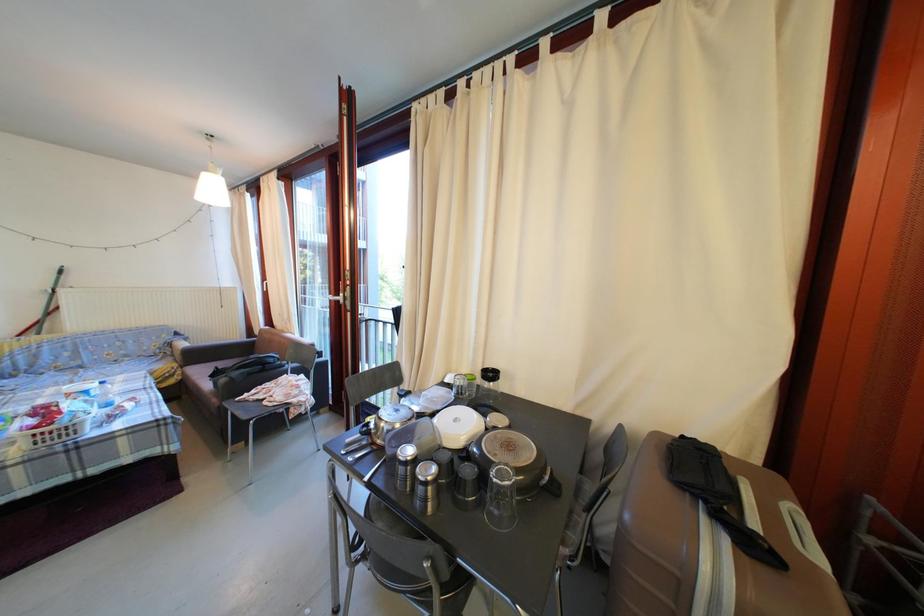
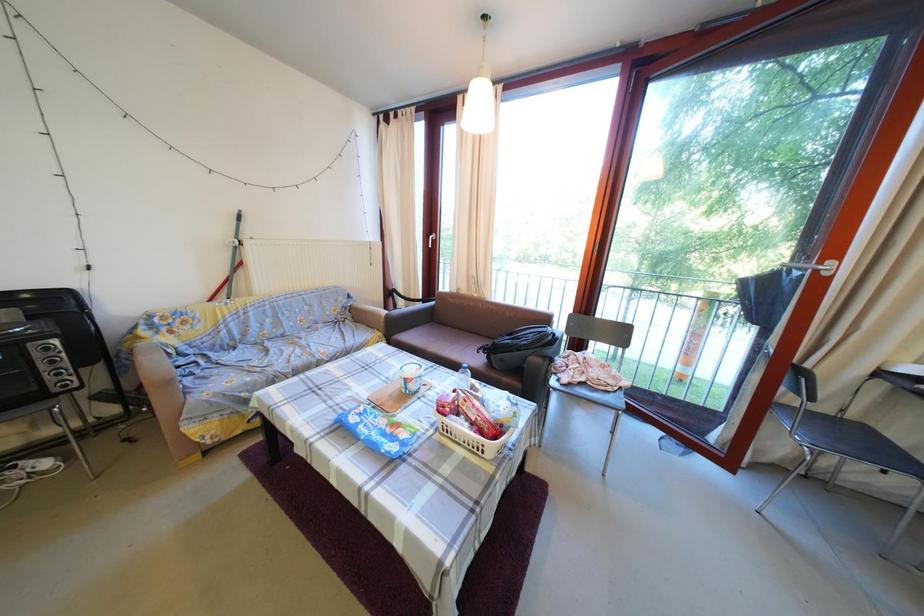
Question: The images are taken continuously from a first-person perspective. In which direction are you moving?

Choices:
 (A) Left
 (B) Right
 (C) Forward
 (D) Backward

Answer: (A)